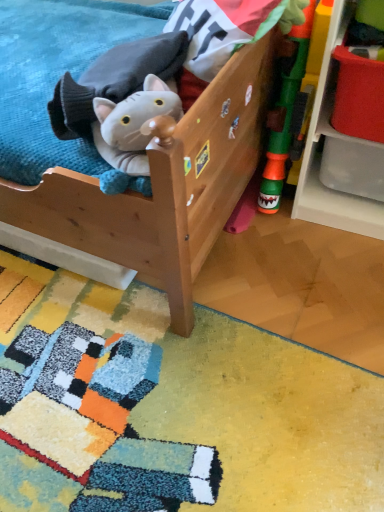
In order to face wooden bed at center, should I rotate leftwards or rightwards?

To face it directly, rotate left by 20.437 degrees.

What is the approximate width of fluffy gray plush cat at upper left, the second toy when ordered from right to left?

fluffy gray plush cat at upper left, the second toy when ordered from right to left, is 9.27 inches in width.

Find the location of `fluffy gray plush cat at upper left, the second toy when ordered from right to left`. fluffy gray plush cat at upper left, the second toy when ordered from right to left is located at coordinates (113, 81).

What do you see at coordinates (284, 116) in the screenshot? I see `rubberized green toy at right, which is the second toy in left-to-right order` at bounding box center [284, 116].

The image size is (384, 512). Find the location of `wooden bed at center`. wooden bed at center is located at coordinates (164, 187).

From a real-world perspective, is white plastic shelf at right physically below wooden bed at center?

Yes, from a real-world perspective, white plastic shelf at right is under wooden bed at center.

Between white plastic shelf at right and wooden bed at center, which one has less height?

white plastic shelf at right.

Is white plastic shelf at right with wooden bed at center?

No, white plastic shelf at right is not next to wooden bed at center.

In the scene shown: Which object is positioned more to the right, white plastic shelf at right or wooden bed at center?

From the viewer's perspective, white plastic shelf at right appears more on the right side.

From a real-world perspective, is fluffy gray plush cat at upper left, the second toy when ordered from right to left, positioned above or below white plastic shelf at right?

fluffy gray plush cat at upper left, the second toy when ordered from right to left, is situated higher than white plastic shelf at right in the real world.

Visually, is fluffy gray plush cat at upper left, which is the first toy from left to right, positioned to the left or to the right of white plastic shelf at right?

fluffy gray plush cat at upper left, which is the first toy from left to right, is positioned on white plastic shelf at right's left side.

Between fluffy gray plush cat at upper left, which is the first toy from left to right, and white plastic shelf at right, which one has smaller size?

fluffy gray plush cat at upper left, which is the first toy from left to right, is smaller.

You are a GUI agent. You are given a task and a screenshot of the screen. Output one action in this format:
    pyautogui.click(x=<x>, y=<y>)
    Task: Click on the shelf behind the fluffy gray plush cat at upper left, which is the first toy from left to right
    
    Given the screenshot: What is the action you would take?
    click(319, 167)

Is white plastic shelf at right inside rubberized green toy at right, the first toy in the right-to-left sequence?

Actually, white plastic shelf at right is outside rubberized green toy at right, the first toy in the right-to-left sequence.

From a real-world perspective, which object rests below the other?

white plastic shelf at right.

From the image's perspective, which is below, rubberized green toy at right, which is the second toy in left-to-right order, or white plastic shelf at right?

rubberized green toy at right, which is the second toy in left-to-right order, is shown below in the image.

Can you confirm if wooden bed at center is smaller than fluffy gray plush cat at upper left, the second toy when ordered from right to left?

Actually, wooden bed at center might be larger than fluffy gray plush cat at upper left, the second toy when ordered from right to left.

From the image's perspective, is wooden bed at center above or below fluffy gray plush cat at upper left, which is the first toy from left to right?

wooden bed at center is situated higher than fluffy gray plush cat at upper left, which is the first toy from left to right, in the image.

Which object is wider, wooden bed at center or fluffy gray plush cat at upper left, which is the first toy from left to right?

Wider between the two is wooden bed at center.

Which is behind, wooden bed at center or fluffy gray plush cat at upper left, the second toy when ordered from right to left?

fluffy gray plush cat at upper left, the second toy when ordered from right to left, is more distant.

From a real-world perspective, is wooden bed at center above or below white plastic shelf at right?

wooden bed at center is above white plastic shelf at right.

This screenshot has width=384, height=512. Identify the location of furniture above the white plastic shelf at right (from a real-world perspective). (164, 187).

Is wooden bed at center bigger or smaller than white plastic shelf at right?

wooden bed at center is bigger than white plastic shelf at right.

Does rubberized green toy at right, the first toy in the right-to-left sequence, have a lesser width compared to wooden bed at center?

Indeed, rubberized green toy at right, the first toy in the right-to-left sequence, has a lesser width compared to wooden bed at center.

Which object is more forward, rubberized green toy at right, which is the second toy in left-to-right order, or wooden bed at center?

wooden bed at center is more forward.

Is rubberized green toy at right, which is the second toy in left-to-right order, positioned with its back to wooden bed at center?

No, wooden bed at center is not at the back of rubberized green toy at right, which is the second toy in left-to-right order.

Which is more to the right, rubberized green toy at right, the first toy in the right-to-left sequence, or wooden bed at center?

rubberized green toy at right, the first toy in the right-to-left sequence, is more to the right.

Is rubberized green toy at right, which is the second toy in left-to-right order, surrounding fluffy gray plush cat at upper left, the second toy when ordered from right to left?

Actually, fluffy gray plush cat at upper left, the second toy when ordered from right to left, is outside rubberized green toy at right, which is the second toy in left-to-right order.

Identify the location of toy directly beneath the fluffy gray plush cat at upper left, which is the first toy from left to right (from a real-world perspective). (284, 116).

Which of these two, rubberized green toy at right, which is the second toy in left-to-right order, or fluffy gray plush cat at upper left, which is the first toy from left to right, is wider?

With larger width is fluffy gray plush cat at upper left, which is the first toy from left to right.

From the image's perspective, which is below, rubberized green toy at right, which is the second toy in left-to-right order, or fluffy gray plush cat at upper left, the second toy when ordered from right to left?

fluffy gray plush cat at upper left, the second toy when ordered from right to left, from the image's perspective.

The image size is (384, 512). In the image, there is a wooden bed at center. In order to click on shelf below it (from a real-world perspective) in this screenshot , I will do `click(319, 167)`.

The height and width of the screenshot is (512, 384). Identify the location of the 2nd toy to the left of the white plastic shelf at right, counting from the anchor's position. click(113, 81).

Looking at the image, which one is located further to fluffy gray plush cat at upper left, the second toy when ordered from right to left, wooden bed at center or white plastic shelf at right?

white plastic shelf at right lies further to fluffy gray plush cat at upper left, the second toy when ordered from right to left, than the other object.

From the image, which object appears to be nearer to rubberized green toy at right, which is the second toy in left-to-right order, wooden bed at center or fluffy gray plush cat at upper left, the second toy when ordered from right to left?

Among the two, wooden bed at center is located nearer to rubberized green toy at right, which is the second toy in left-to-right order.

Which object lies further to the anchor point white plastic shelf at right, fluffy gray plush cat at upper left, the second toy when ordered from right to left, or wooden bed at center?

The object further to white plastic shelf at right is fluffy gray plush cat at upper left, the second toy when ordered from right to left.

From the picture: Considering their positions, is white plastic shelf at right positioned closer to fluffy gray plush cat at upper left, which is the first toy from left to right, than rubberized green toy at right, which is the second toy in left-to-right order?

The object closer to fluffy gray plush cat at upper left, which is the first toy from left to right, is rubberized green toy at right, which is the second toy in left-to-right order.

In the scene shown: Based on their spatial positions, is fluffy gray plush cat at upper left, which is the first toy from left to right, or rubberized green toy at right, which is the second toy in left-to-right order, closer to wooden bed at center?

fluffy gray plush cat at upper left, which is the first toy from left to right, is positioned closer to the anchor wooden bed at center.

When comparing their distances from white plastic shelf at right, does fluffy gray plush cat at upper left, which is the first toy from left to right, or rubberized green toy at right, which is the second toy in left-to-right order, seem further?

Among the two, fluffy gray plush cat at upper left, which is the first toy from left to right, is located further to white plastic shelf at right.

Which object lies further to the anchor point rubberized green toy at right, the first toy in the right-to-left sequence, white plastic shelf at right or fluffy gray plush cat at upper left, the second toy when ordered from right to left?

fluffy gray plush cat at upper left, the second toy when ordered from right to left, is positioned further to the anchor rubberized green toy at right, the first toy in the right-to-left sequence.

Based on the photo, from the image, which object appears to be farther from rubberized green toy at right, the first toy in the right-to-left sequence, wooden bed at center or white plastic shelf at right?

Based on the image, wooden bed at center appears to be further to rubberized green toy at right, the first toy in the right-to-left sequence.

Find the location of a particular element. toy between wooden bed at center and rubberized green toy at right, the first toy in the right-to-left sequence, in the horizontal direction is located at coordinates (x=113, y=81).

Identify the location of toy located between fluffy gray plush cat at upper left, which is the first toy from left to right, and white plastic shelf at right in the left-right direction. Image resolution: width=384 pixels, height=512 pixels. (284, 116).